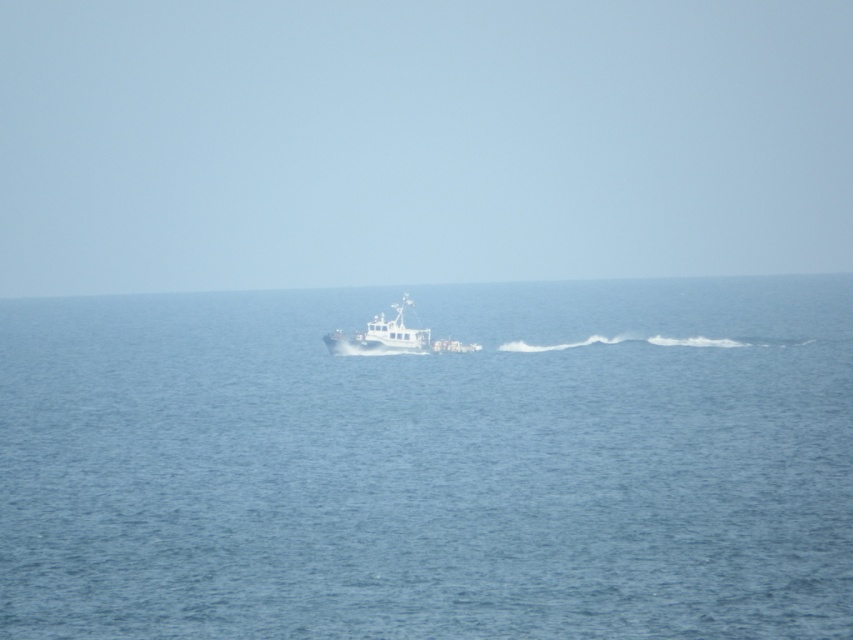
You are a sailor trying to navigate a small boat. You notice the blue water at center and the white matte boat at center. Which object appears higher in the image?

The blue water at center is taller than the white matte boat at center, so the blue water at center appears higher in the image.

Based on the photo, you are standing on a cliff overlooking the sea and see the blue water at center and the white matte boat at center. Which object appears nearer to you?

The blue water at center appears nearer to you because it is closer to the viewer than the white matte boat at center.

You are a photographer trying to capture the white matte boat at center in your shot. Since the blue water at center takes up most of the frame, will the boat be too small to be clearly visible?

The blue water at center is bigger than the white matte boat at center, so the boat may appear small in the photo compared to the water, but it should still be visible as it is positioned off the center towards the left side.